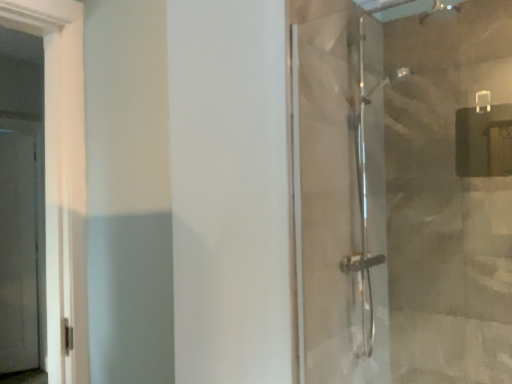
Question: Does transparent glass shower door at right have a greater width compared to clear glass screen door at left?

Choices:
 (A) yes
 (B) no

Answer: (B)

Question: Is transparent glass shower door at right aimed at clear glass screen door at left?

Choices:
 (A) no
 (B) yes

Answer: (A)

Question: Is transparent glass shower door at right outside clear glass screen door at left?

Choices:
 (A) yes
 (B) no

Answer: (A)

Question: Is transparent glass shower door at right bigger than clear glass screen door at left?

Choices:
 (A) yes
 (B) no

Answer: (B)

Question: Considering the relative positions of transparent glass shower door at right and clear glass screen door at left in the image provided, is transparent glass shower door at right to the left of clear glass screen door at left from the viewer's perspective?

Choices:
 (A) yes
 (B) no

Answer: (B)

Question: Is transparent glass shower door at right positioned before clear glass screen door at left?

Choices:
 (A) yes
 (B) no

Answer: (A)

Question: From a real-world perspective, does clear glass screen door at left stand above transparent glass shower door at right?

Choices:
 (A) yes
 (B) no

Answer: (B)

Question: Considering the relative sizes of clear glass screen door at left and transparent glass shower door at right in the image provided, is clear glass screen door at left taller than transparent glass shower door at right?

Choices:
 (A) no
 (B) yes

Answer: (B)

Question: From a real-world perspective, is clear glass screen door at left under transparent glass shower door at right?

Choices:
 (A) no
 (B) yes

Answer: (B)

Question: Does clear glass screen door at left lie behind transparent glass shower door at right?

Choices:
 (A) yes
 (B) no

Answer: (A)

Question: Can we say clear glass screen door at left lies outside transparent glass shower door at right?

Choices:
 (A) no
 (B) yes

Answer: (B)

Question: Does clear glass screen door at left turn towards transparent glass shower door at right?

Choices:
 (A) no
 (B) yes

Answer: (A)

Question: Is clear glass screen door at left in front of or behind transparent glass shower door at right in the image?

Choices:
 (A) front
 (B) behind

Answer: (B)